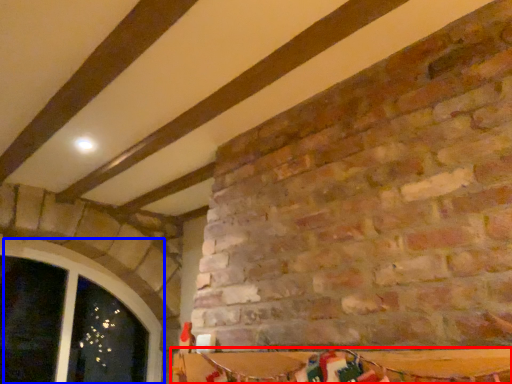
Question: Which point is closer to the camera, table (highlighted by a red box) or window (highlighted by a blue box)?

Choices:
 (A) table
 (B) window

Answer: (A)